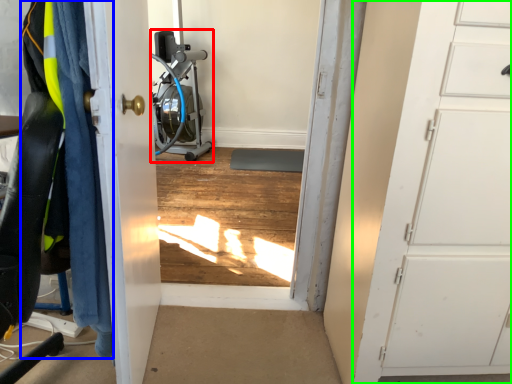
Question: Based on their relative distances, which object is farther from sport equipment (highlighted by a red box)? Choose from clothing (highlighted by a blue box) and door (highlighted by a green box).

Choices:
 (A) clothing
 (B) door

Answer: (B)